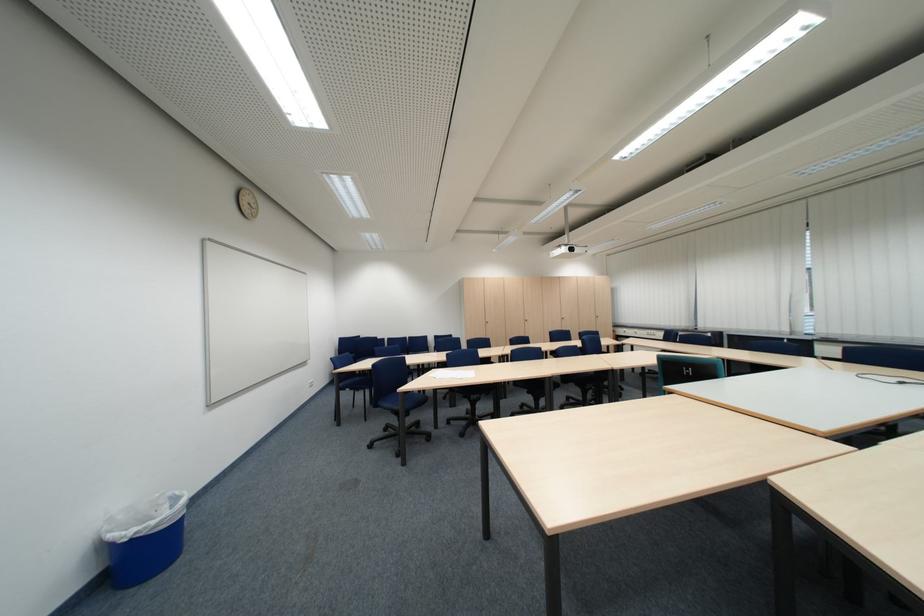
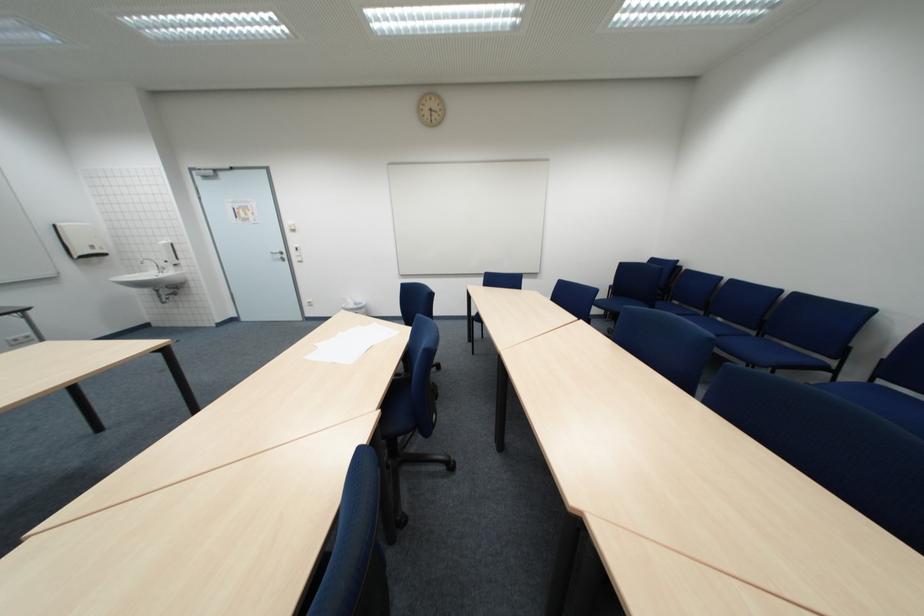
Question: I am providing you with two images of the same scene from different viewpoints. After the viewpoint changes to image2, which objects are now occluded?

Choices:
 (A) paper towel dispenser
 (B) white light switch
 (C) green spray bottle trigger
 (D) blue chair sitting surface

Answer: (D)